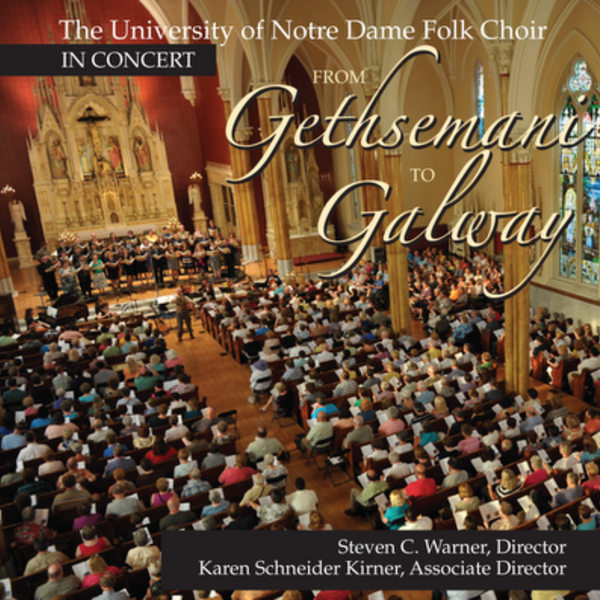
Where is `pillar`? This screenshot has height=600, width=600. pillar is located at coordinates (515, 355), (398, 271), (278, 231), (243, 212).